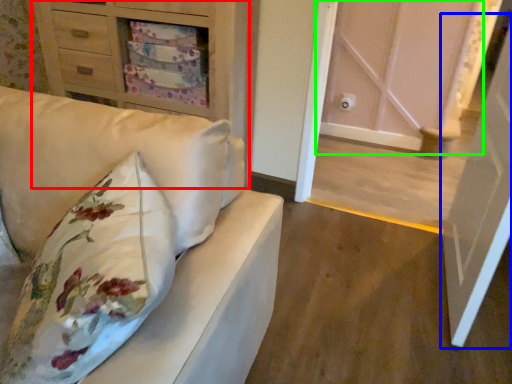
Question: Estimate the real-world distances between objects in this image. Which object is closer to chest of drawers (highlighted by a red box), door (highlighted by a blue box) or door (highlighted by a green box)?

Choices:
 (A) door
 (B) door

Answer: (A)